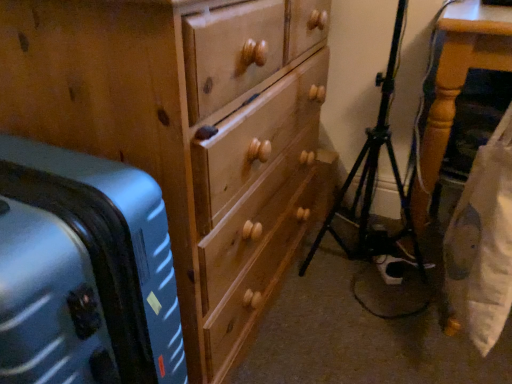
Where is `wooden table at right`? This screenshot has width=512, height=384. wooden table at right is located at coordinates (458, 83).

The height and width of the screenshot is (384, 512). What do you see at coordinates (84, 272) in the screenshot? I see `metallic blue suitcase at left` at bounding box center [84, 272].

This screenshot has height=384, width=512. In order to click on wooden chest of drawers at center in this screenshot , I will do `click(187, 131)`.

Find the location of a particular element. The width and height of the screenshot is (512, 384). black metal tripod at lower right is located at coordinates (373, 175).

You are a GUI agent. You are given a task and a screenshot of the screen. Output one action in this format:
    pyautogui.click(x=<x>, y=<y>)
    Task: Click on the wooden table at right
    
    Given the screenshot: What is the action you would take?
    pyautogui.click(x=458, y=83)

Could you tell me if black metal tripod at lower right is facing wooden chest of drawers at center?

No.

Does black metal tripod at lower right appear on the right side of wooden chest of drawers at center?

Correct, you'll find black metal tripod at lower right to the right of wooden chest of drawers at center.

Is black metal tripod at lower right not near wooden chest of drawers at center?

No, black metal tripod at lower right is in close proximity to wooden chest of drawers at center.

Between black metal tripod at lower right and wooden chest of drawers at center, which one has more height?

wooden chest of drawers at center.

Considering the positions of objects wooden table at right and black metal tripod at lower right in the image provided, who is behind, wooden table at right or black metal tripod at lower right?

wooden table at right is further from the camera.

Consider the image. From a real-world perspective, who is located higher, wooden table at right or black metal tripod at lower right?

black metal tripod at lower right, from a real-world perspective.

Could you tell me if wooden table at right is turned towards black metal tripod at lower right?

No, wooden table at right is not oriented towards black metal tripod at lower right.

Would you say wooden table at right is to the left or to the right of black metal tripod at lower right in the picture?

wooden table at right is positioned on black metal tripod at lower right's right side.

Is wooden chest of drawers at center touching wooden table at right?

No, wooden chest of drawers at center is not touching wooden table at right.

Consider the image. From the image's perspective, is wooden chest of drawers at center located above or below wooden table at right?

wooden chest of drawers at center is below wooden table at right.

Is wooden chest of drawers at center positioned before wooden table at right?

Yes, wooden chest of drawers at center is closer to the viewer.

Is wooden chest of drawers at center to the left or to the right of wooden table at right in the image?

In the image, wooden chest of drawers at center appears on the left side of wooden table at right.

Which is more to the left, wooden chest of drawers at center or black metal tripod at lower right?

wooden chest of drawers at center is more to the left.

Would you say wooden chest of drawers at center is outside black metal tripod at lower right?

wooden chest of drawers at center lies outside black metal tripod at lower right's area.

Between wooden chest of drawers at center and black metal tripod at lower right, which one is positioned behind?

Positioned behind is black metal tripod at lower right.

At what (x,y) coordinates should I click in order to perform the action: click on chest of drawers above the black metal tripod at lower right (from the image's perspective). Please return your answer as a coordinate pair (x, y). The image size is (512, 384). Looking at the image, I should click on (187, 131).

Considering the sizes of wooden table at right and wooden chest of drawers at center in the image, is wooden table at right wider or thinner than wooden chest of drawers at center?

Considering their sizes, wooden table at right looks broader than wooden chest of drawers at center.

From the image's perspective, would you say wooden table at right is positioned over wooden chest of drawers at center?

Yes, from the image's perspective, wooden table at right is on top of wooden chest of drawers at center.

Are wooden table at right and wooden chest of drawers at center far apart?

No.

Is point (444, 89) positioned before point (99, 141)?

No, it is behind (99, 141).

From a real-world perspective, is metallic blue suitcase at left over wooden table at right?

Actually, metallic blue suitcase at left is physically below wooden table at right in the real world.

Is wooden table at right a part of metallic blue suitcase at left?

No, wooden table at right is not inside metallic blue suitcase at left.

From the image's perspective, which is above, metallic blue suitcase at left or wooden table at right?

wooden table at right.

Between metallic blue suitcase at left and wooden table at right, which one has larger size?

Bigger between the two is wooden table at right.

Is metallic blue suitcase at left oriented towards black metal tripod at lower right?

No, metallic blue suitcase at left is not turned towards black metal tripod at lower right.

Is black metal tripod at lower right completely or partially inside metallic blue suitcase at left?

No.

Considering the sizes of metallic blue suitcase at left and black metal tripod at lower right in the image, is metallic blue suitcase at left wider or thinner than black metal tripod at lower right?

Clearly, metallic blue suitcase at left has more width compared to black metal tripod at lower right.

From the image's perspective, is metallic blue suitcase at left on top of black metal tripod at lower right?

No, from the image's perspective, metallic blue suitcase at left is not above black metal tripod at lower right.

What are the coordinates of `chest of drawers lying on the left of black metal tripod at lower right` in the screenshot? It's located at (187, 131).

Identify the location of furniture behind the black metal tripod at lower right. This screenshot has width=512, height=384. click(x=458, y=83).

Which object lies further to the anchor point black metal tripod at lower right, wooden chest of drawers at center or wooden table at right?

wooden chest of drawers at center is further to black metal tripod at lower right.

Looking at the image, which one is located further to wooden chest of drawers at center, metallic blue suitcase at left or black metal tripod at lower right?

Based on the image, black metal tripod at lower right appears to be further to wooden chest of drawers at center.

Estimate the real-world distances between objects in this image. Which object is closer to wooden table at right, metallic blue suitcase at left or black metal tripod at lower right?

black metal tripod at lower right is closer to wooden table at right.

When comparing their distances from black metal tripod at lower right, does metallic blue suitcase at left or wooden table at right seem closer?

wooden table at right is closer to black metal tripod at lower right.

When comparing their distances from black metal tripod at lower right, does wooden table at right or wooden chest of drawers at center seem further?

wooden chest of drawers at center is positioned further to the anchor black metal tripod at lower right.

Looking at the image, which one is located further to wooden table at right, black metal tripod at lower right or wooden chest of drawers at center?

wooden chest of drawers at center.

Which object lies further to the anchor point wooden table at right, black metal tripod at lower right or metallic blue suitcase at left?

Among the two, metallic blue suitcase at left is located further to wooden table at right.

Looking at the image, which one is located further to wooden chest of drawers at center, wooden table at right or black metal tripod at lower right?

Based on the image, wooden table at right appears to be further to wooden chest of drawers at center.

I want to click on chest of drawers between metallic blue suitcase at left and black metal tripod at lower right in the horizontal direction, so click(x=187, y=131).

This screenshot has width=512, height=384. What are the coordinates of `tripod located between wooden chest of drawers at center and wooden table at right in the left-right direction` in the screenshot? It's located at (373, 175).

Locate an element on the screen. This screenshot has width=512, height=384. tripod between metallic blue suitcase at left and wooden table at right from left to right is located at coordinates (373, 175).

At what (x,y) coordinates should I click in order to perform the action: click on chest of drawers between metallic blue suitcase at left and wooden table at right from left to right. Please return your answer as a coordinate pair (x, y). Looking at the image, I should click on (187, 131).